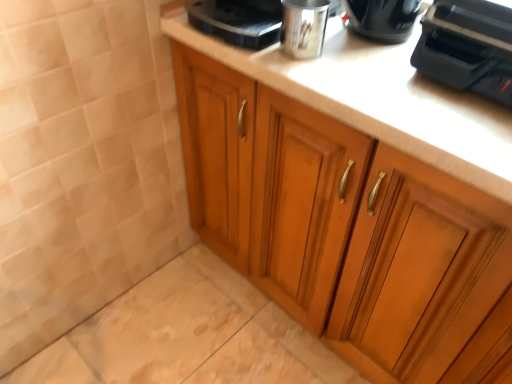
Question: Considering the positions of black plastic toaster at upper right and wooden cabinet at center in the image, is black plastic toaster at upper right bigger or smaller than wooden cabinet at center?

Choices:
 (A) small
 (B) big

Answer: (A)

Question: From a real-world perspective, is black plastic toaster at upper right above or below wooden cabinet at center?

Choices:
 (A) above
 (B) below

Answer: (A)

Question: From the image's perspective, is black plastic toaster at upper right above or below wooden cabinet at center?

Choices:
 (A) below
 (B) above

Answer: (B)

Question: In terms of size, does wooden cabinet at center appear bigger or smaller than black plastic toaster at upper right?

Choices:
 (A) big
 (B) small

Answer: (A)

Question: Considering their positions, is wooden cabinet at center located in front of or behind black plastic toaster at upper right?

Choices:
 (A) front
 (B) behind

Answer: (A)

Question: From the image's perspective, relative to black plastic toaster at upper right, is wooden cabinet at center above or below?

Choices:
 (A) below
 (B) above

Answer: (A)

Question: Considering the positions of wooden cabinet at center and black plastic toaster at upper right in the image, is wooden cabinet at center wider or thinner than black plastic toaster at upper right?

Choices:
 (A) thin
 (B) wide

Answer: (B)